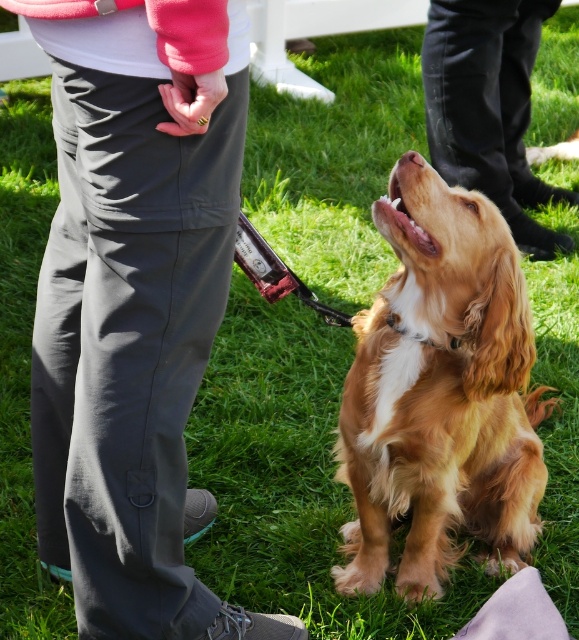
Can you confirm if golden fur dog at center is thinner than black smooth pants at center?

Correct, golden fur dog at center's width is less than black smooth pants at center's.

Which of these two, golden fur dog at center or black smooth pants at center, stands taller?

black smooth pants at center is taller.

Is point (521, 362) positioned after point (515, 104)?

No.

Where is `golden fur dog at center`? The height and width of the screenshot is (640, 579). golden fur dog at center is located at coordinates (441, 394).